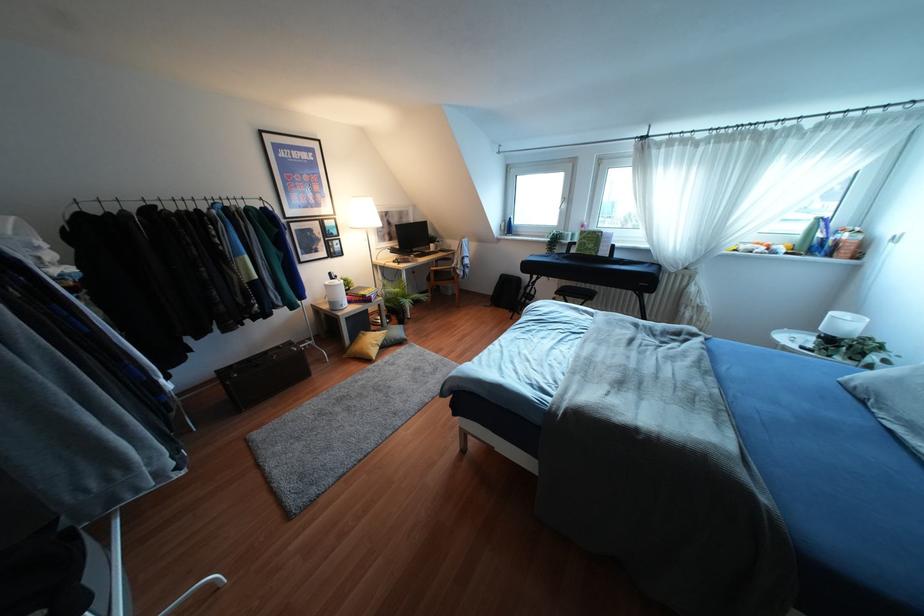
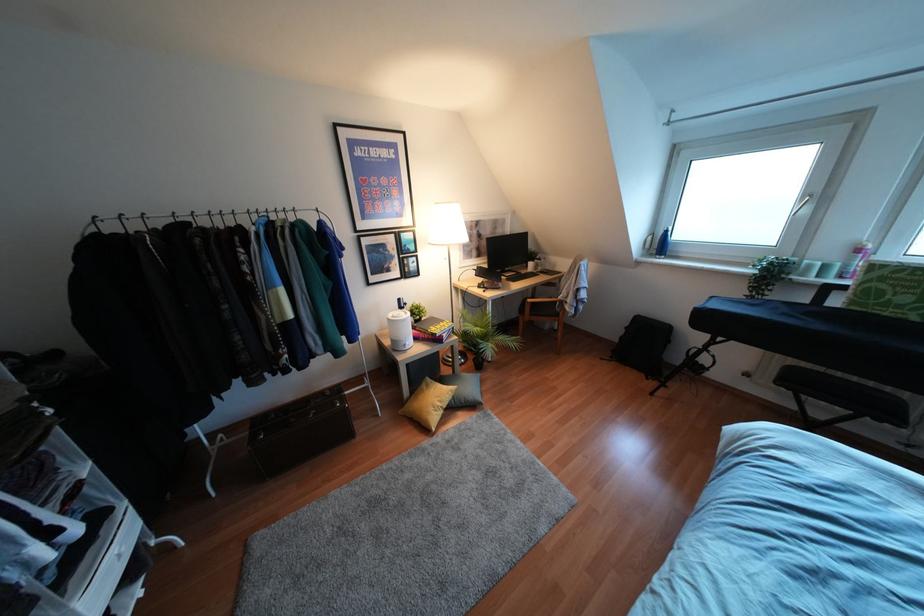
Question: Which direction would the cameraman need to move to produce the second image? Reply with the corresponding letter.

Choices:
 (A) Left
 (B) Right
 (C) Forward
 (D) Backward

Answer: (C)